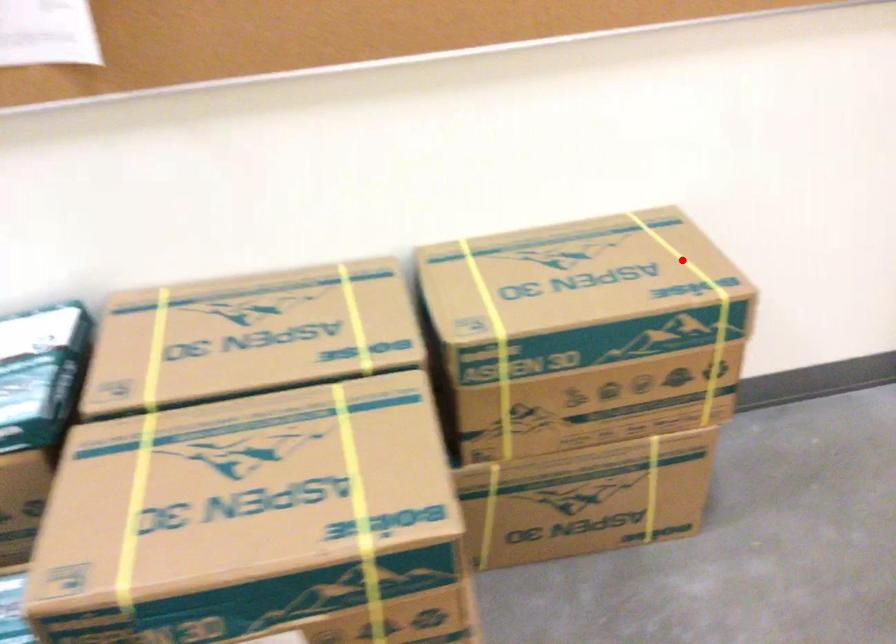
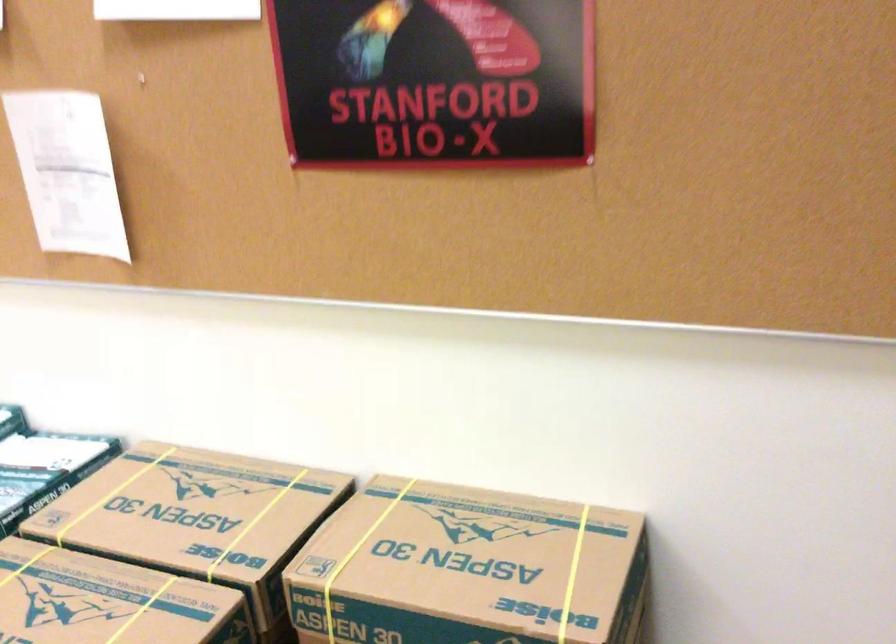
Where in the second image is the point corresponding to the highlighted location from the first image?

(572, 574)